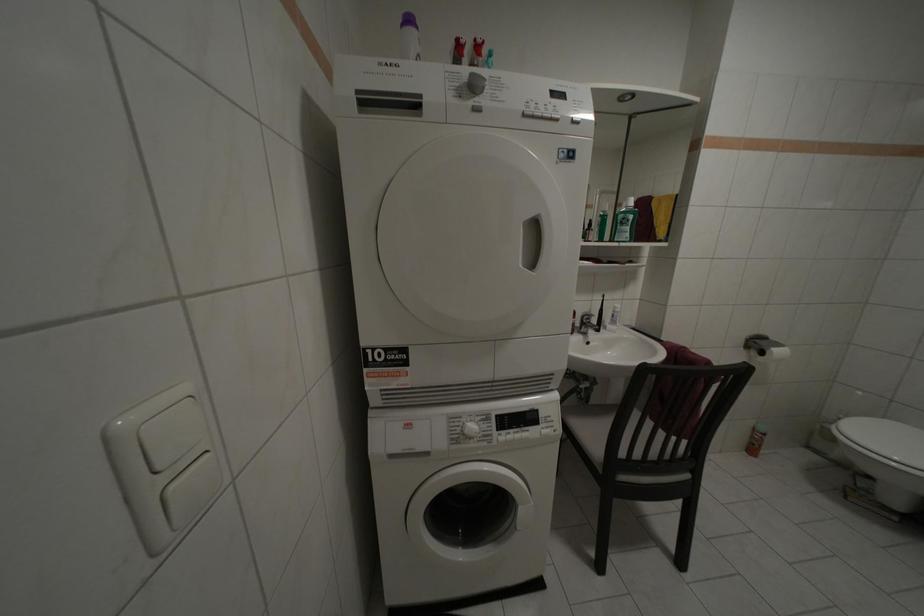
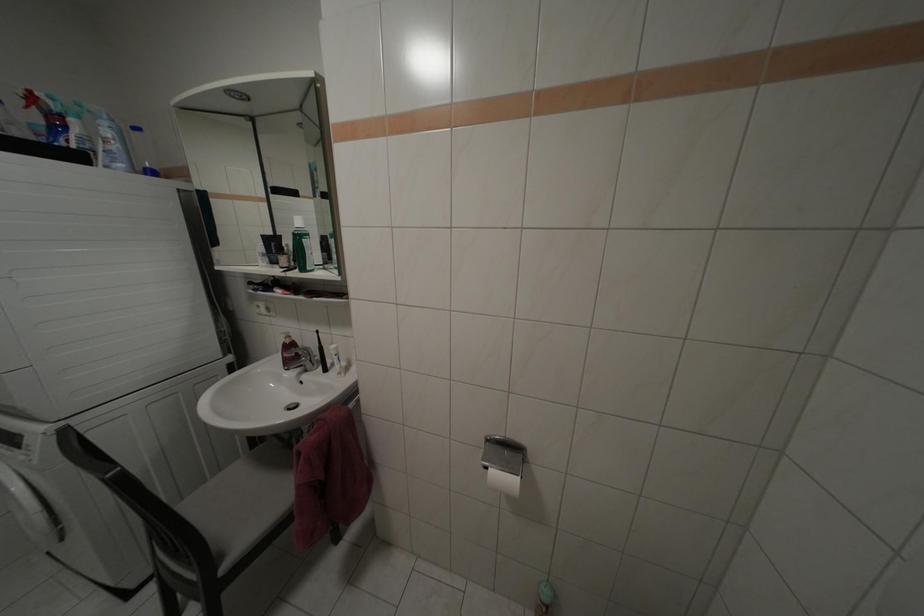
Question: What movement of the cameraman would produce the second image?

Choices:
 (A) Left
 (B) Right
 (C) Forward
 (D) Backward

Answer: (B)